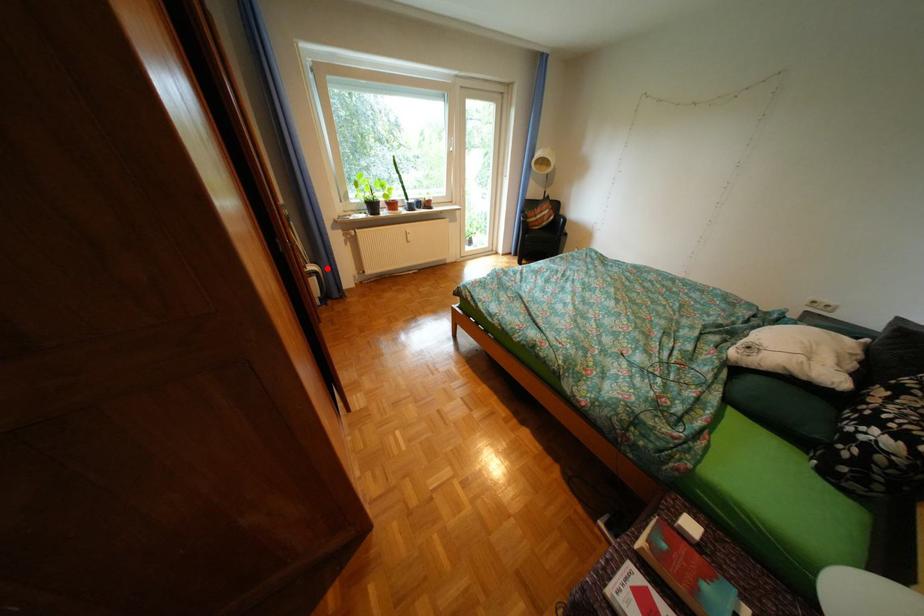
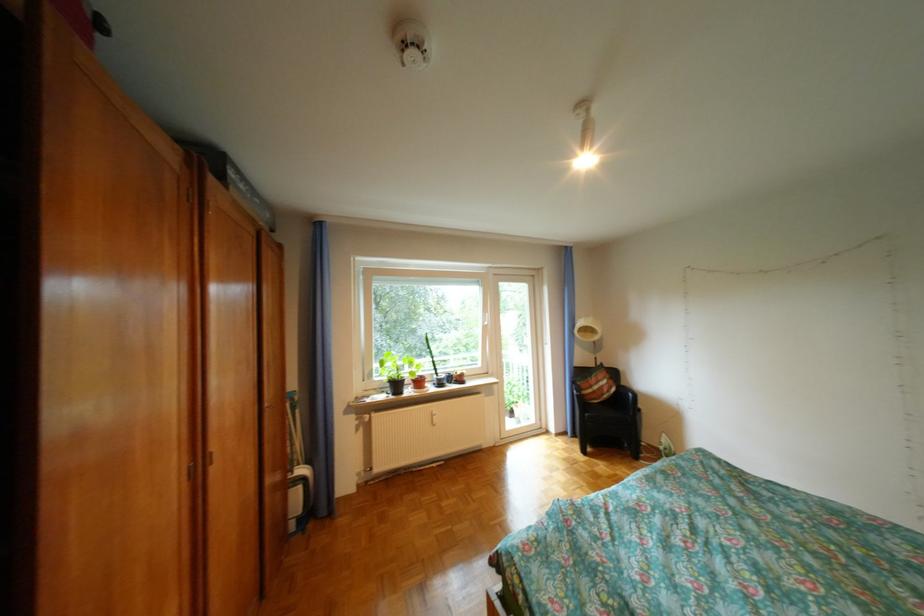
The point at the highlighted location is marked in the first image. Where is the corresponding point in the second image?

(317, 471)